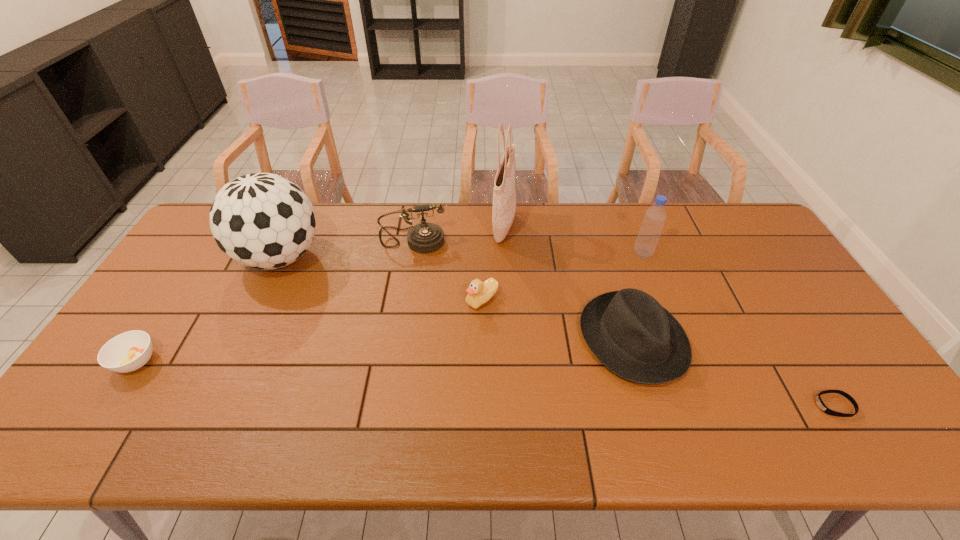
Where is `empty location between the seventh tallest object and the fedora`? The width and height of the screenshot is (960, 540). empty location between the seventh tallest object and the fedora is located at coordinates (384, 350).

Locate an element on the screen. This screenshot has height=540, width=960. free space that is in between the tallest object and the third tallest object is located at coordinates (573, 240).

Identify the location of empty space that is in between the shopping bag and the telephone. This screenshot has width=960, height=540. (458, 233).

Locate an element on the screen. This screenshot has height=540, width=960. free space between the telephone and the fedora is located at coordinates (522, 289).

The width and height of the screenshot is (960, 540). I want to click on free space between the sixth tallest object and the soccer ball, so click(x=381, y=279).

The height and width of the screenshot is (540, 960). What are the coordinates of `object that stands as the third closest to the sixth tallest object` in the screenshot? It's located at (629, 331).

Identify which object is the closest to the soccer ball. Please provide its 2D coordinates. Your answer should be formatted as a tuple, i.e. [(x, y)], where the tuple contains the x and y coordinates of a point satisfying the conditions above.

[(425, 237)]

Image resolution: width=960 pixels, height=540 pixels. I want to click on vacant point that satisfies the following two spatial constraints: 1. on the front side of the telephone; 2. on the left side of the third tallest object, so click(x=409, y=254).